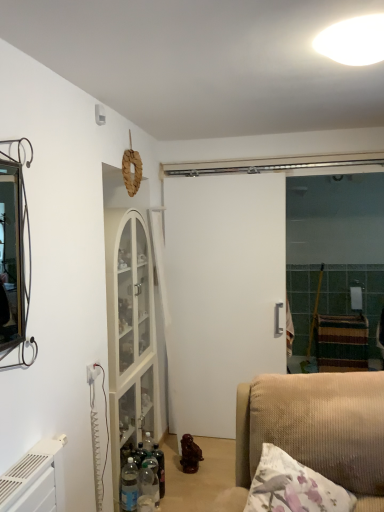
Question: Which direction should I rotate to look at translucent glass bottle at center, marked as the first bottle in a back-to-front arrangement, — up or down?

Choices:
 (A) up
 (B) down

Answer: (B)

Question: Can translucent plastic bottles at lower left, the second bottle from the front, be found inside white matte door at center?

Choices:
 (A) yes
 (B) no

Answer: (B)

Question: Is white matte door at center positioned in front of translucent plastic bottles at lower left, acting as the second bottle starting from the back?

Choices:
 (A) yes
 (B) no

Answer: (B)

Question: Is white matte door at center facing towards translucent plastic bottles at lower left, the second bottle from the front?

Choices:
 (A) no
 (B) yes

Answer: (B)

Question: Can you confirm if white matte door at center is thinner than translucent plastic bottles at lower left, acting as the second bottle starting from the back?

Choices:
 (A) no
 (B) yes

Answer: (B)

Question: Is white matte door at center taller than translucent plastic bottles at lower left, acting as the second bottle starting from the back?

Choices:
 (A) no
 (B) yes

Answer: (B)

Question: Can you confirm if white matte door at center is shorter than translucent plastic bottles at lower left, the second bottle from the front?

Choices:
 (A) yes
 (B) no

Answer: (B)

Question: Can you confirm if translucent plastic bottles at lower left, the second bottle from the front, is shorter than translucent plastic bottle at lower center, the 1th bottle positioned from the front?

Choices:
 (A) yes
 (B) no

Answer: (B)

Question: Does translucent plastic bottles at lower left, acting as the second bottle starting from the back, have a lesser width compared to translucent plastic bottle at lower center, which is the 3th bottle from back to front?

Choices:
 (A) no
 (B) yes

Answer: (A)

Question: Is translucent plastic bottles at lower left, the second bottle from the front, facing away from translucent plastic bottle at lower center, the 1th bottle positioned from the front?

Choices:
 (A) yes
 (B) no

Answer: (A)

Question: Are translucent plastic bottles at lower left, the second bottle from the front, and translucent plastic bottle at lower center, the 1th bottle positioned from the front, beside each other?

Choices:
 (A) no
 (B) yes

Answer: (B)

Question: From a real-world perspective, is translucent plastic bottles at lower left, acting as the second bottle starting from the back, positioned under translucent plastic bottle at lower center, which is the 3th bottle from back to front, based on gravity?

Choices:
 (A) yes
 (B) no

Answer: (B)

Question: Is translucent plastic bottles at lower left, the second bottle from the front, not within translucent plastic bottle at lower center, which is the 3th bottle from back to front?

Choices:
 (A) no
 (B) yes

Answer: (B)

Question: Is white glossy light fixture at upper center looking in the opposite direction of translucent plastic bottle at lower center, the 1th bottle positioned from the front?

Choices:
 (A) yes
 (B) no

Answer: (B)